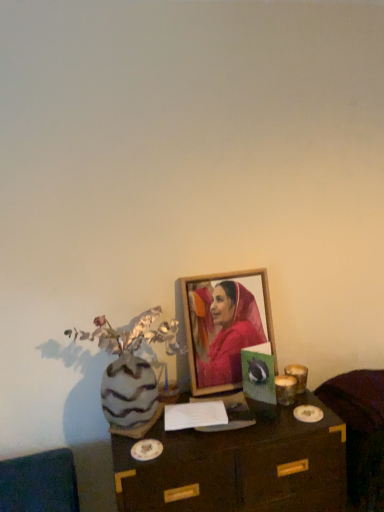
Question: From the image's perspective, is wooden table at center located above or below velvet dark brown armchair at lower right?

Choices:
 (A) above
 (B) below

Answer: (B)

Question: Considering the positions of point (129, 474) and point (377, 435), is point (129, 474) closer or farther from the camera than point (377, 435)?

Choices:
 (A) closer
 (B) farther

Answer: (A)

Question: Based on their relative distances, which object is farther from the wooden picture frame at center?

Choices:
 (A) wooden table at center
 (B) velvet dark brown armchair at lower right

Answer: (B)

Question: Which object is positioned closest to the wooden table at center?

Choices:
 (A) velvet dark brown armchair at lower right
 (B) wooden picture frame at center

Answer: (A)